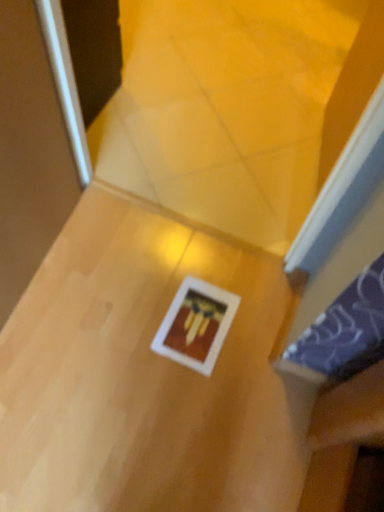
This screenshot has height=512, width=384. In order to click on vacant space to the right of white matte picture frame at center in this screenshot , I will do `click(255, 348)`.